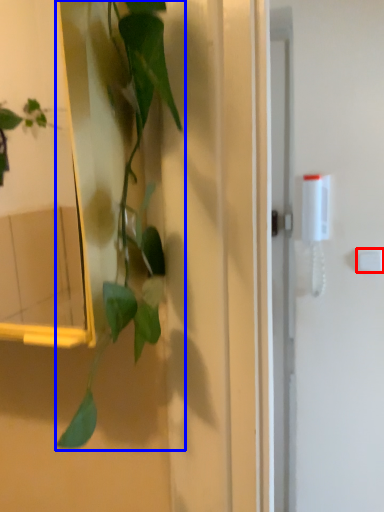
Question: Which point is further to the camera, light switch (highlighted by a red box) or houseplant (highlighted by a blue box)?

Choices:
 (A) light switch
 (B) houseplant

Answer: (A)